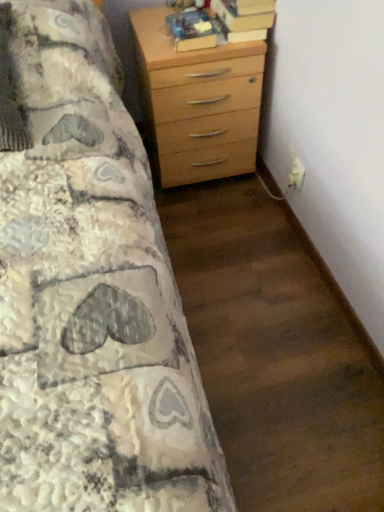
Where is `free spot to the left of hardcover book at upper center, which ranks as the 1th book in left-to-right order`? The width and height of the screenshot is (384, 512). free spot to the left of hardcover book at upper center, which ranks as the 1th book in left-to-right order is located at coordinates (155, 41).